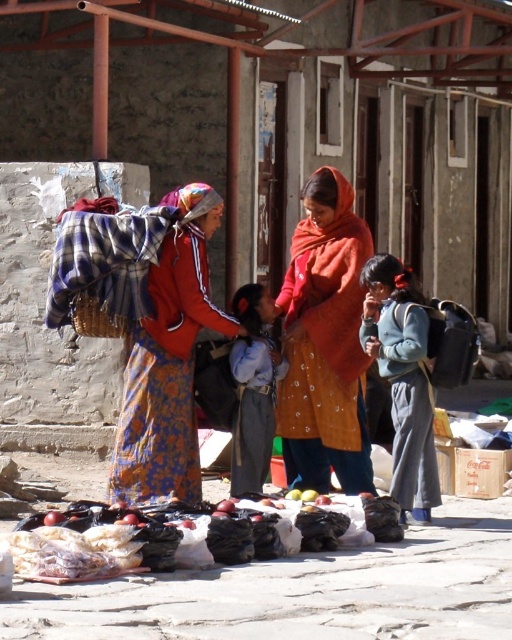
You are a tailor observing two blue garments in a market scene. The blue denim jacket at center and the blue fabric shirt at center are both displayed for sale. Which garment appears taller when viewed from the front?

The blue denim jacket at center appears taller than the blue fabric shirt at center when viewed from the front because the blue denim jacket at center has a greater height compared to blue fabric shirt at center.

You are standing at point (224, 509) and want to walk to point (359, 269). Given the street scene described, will you have to move forward or backward to reach your destination?

Since point (359, 269) is behind point (224, 509), you will have to move backward to reach it.

You are a street vendor who wants to place both the orange fabric shawl at center and the shiny red apple at center on your display table. Given their sizes, which item should you place first to ensure they both fit properly?

The orange fabric shawl at center is wider than the shiny red apple at center, so you should place the orange fabric shawl at center first to ensure both items fit properly on the display table.